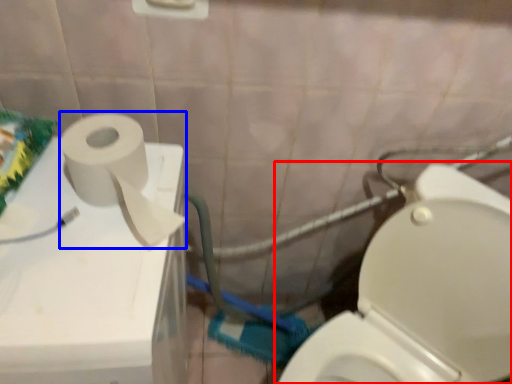
Question: Which of the following is the closest to the observer, toilet (highlighted by a red box) or toiletry paper (highlighted by a blue box)?

Choices:
 (A) toilet
 (B) toiletry paper

Answer: (A)